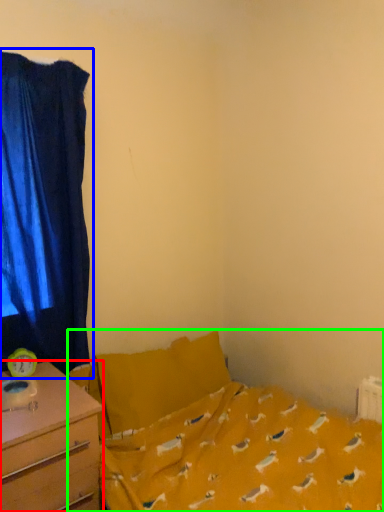
Question: Estimate the real-world distances between objects in this image. Which object is closer to desk (highlighted by a red box), curtain (highlighted by a blue box) or bed (highlighted by a green box)?

Choices:
 (A) curtain
 (B) bed

Answer: (B)